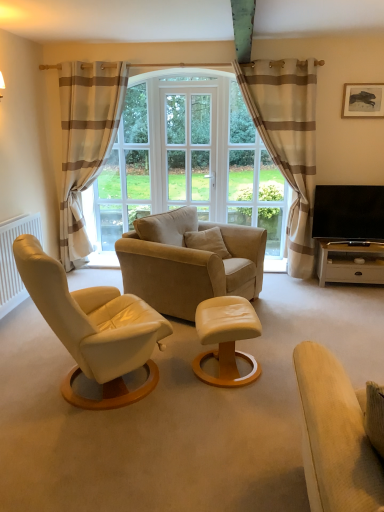
What are the coordinates of `blank space to the left of matte leather ottoman at center, which is the 1th table from bottom to top` in the screenshot? It's located at (165, 381).